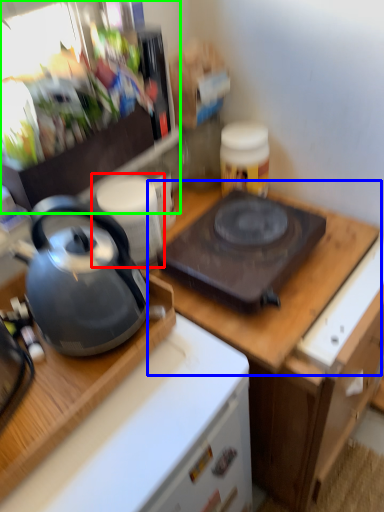
Question: Which is farther away from appliance (highlighted by a red box)? counter top (highlighted by a blue box) or appliance (highlighted by a green box)?

Choices:
 (A) counter top
 (B) appliance

Answer: (A)